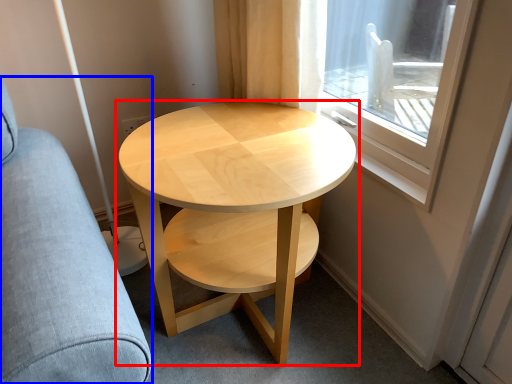
Question: Among these objects, which one is nearest to the camera, coffee table (highlighted by a red box) or swivel chair (highlighted by a blue box)?

Choices:
 (A) coffee table
 (B) swivel chair

Answer: (B)